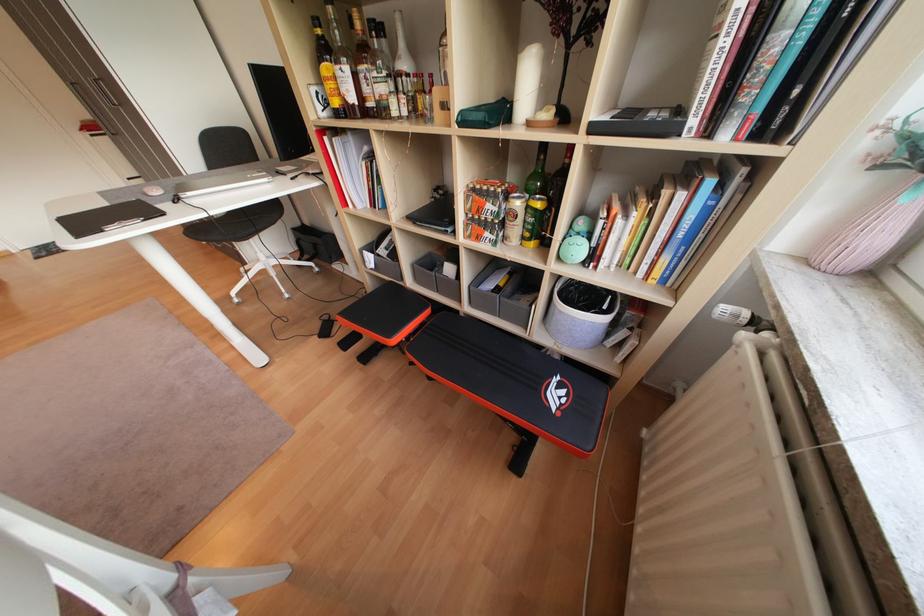
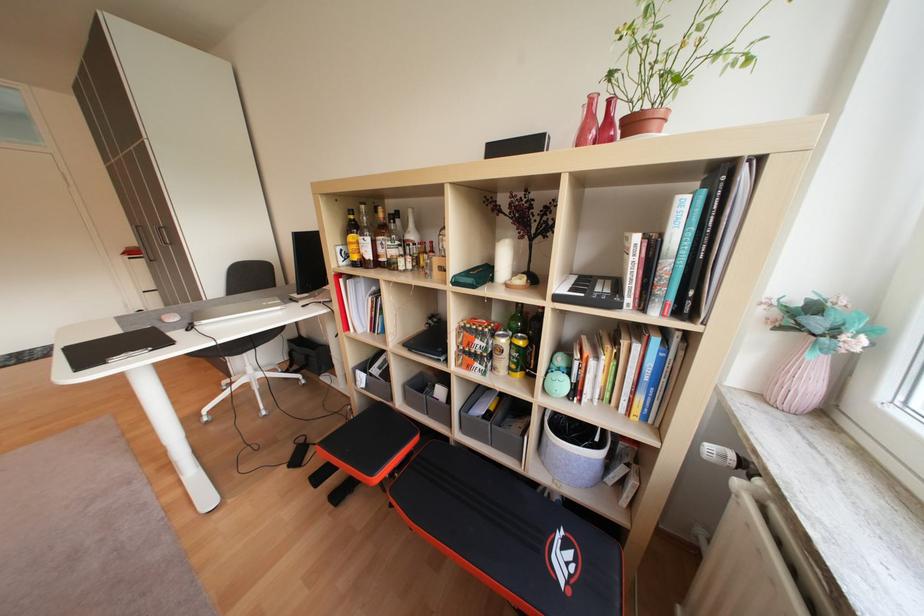
Question: Which direction would the cameraman need to move to produce the second image? Reply with the corresponding letter.

Choices:
 (A) Left
 (B) Right
 (C) Forward
 (D) Backward

Answer: (D)